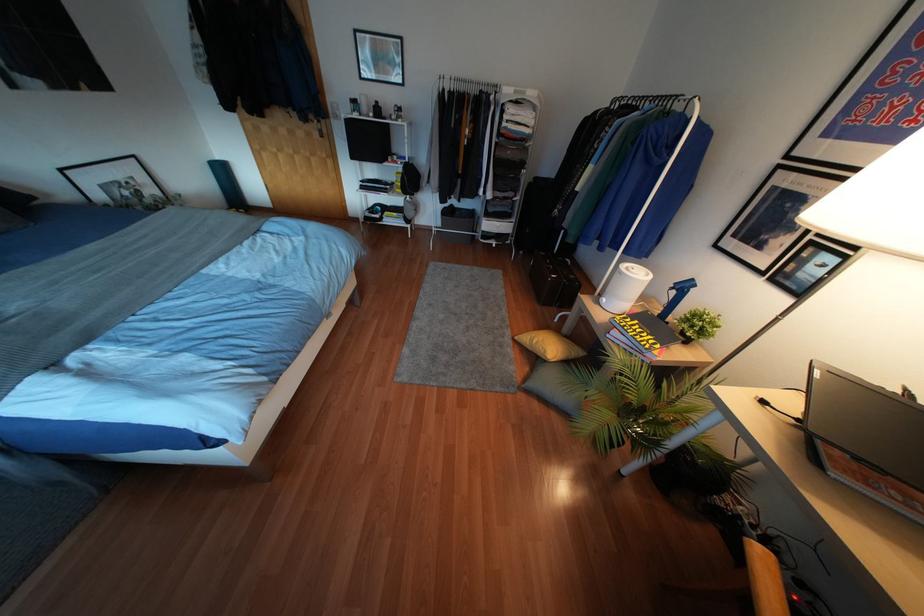
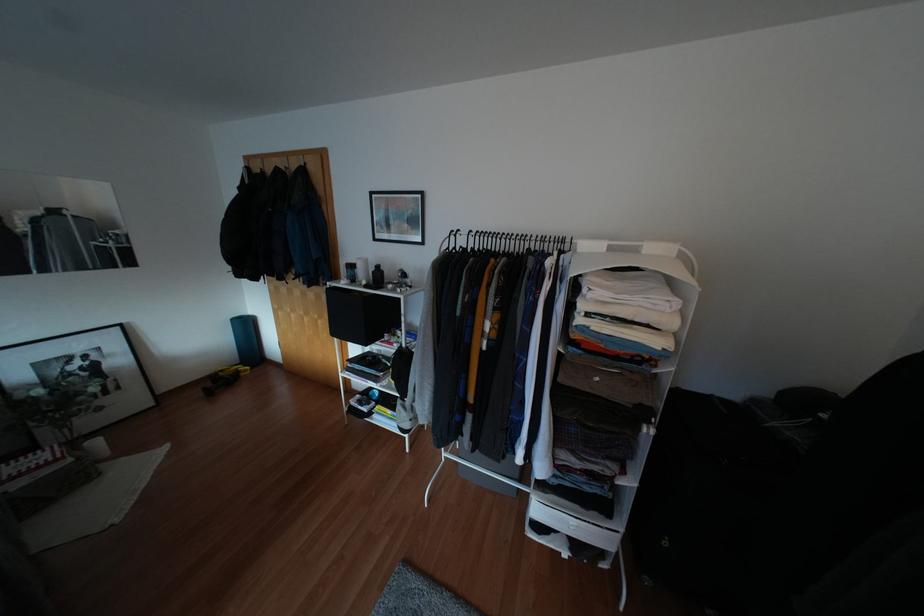
Where in the second image is the point corresponding to (x=222, y=169) from the first image?

(246, 325)